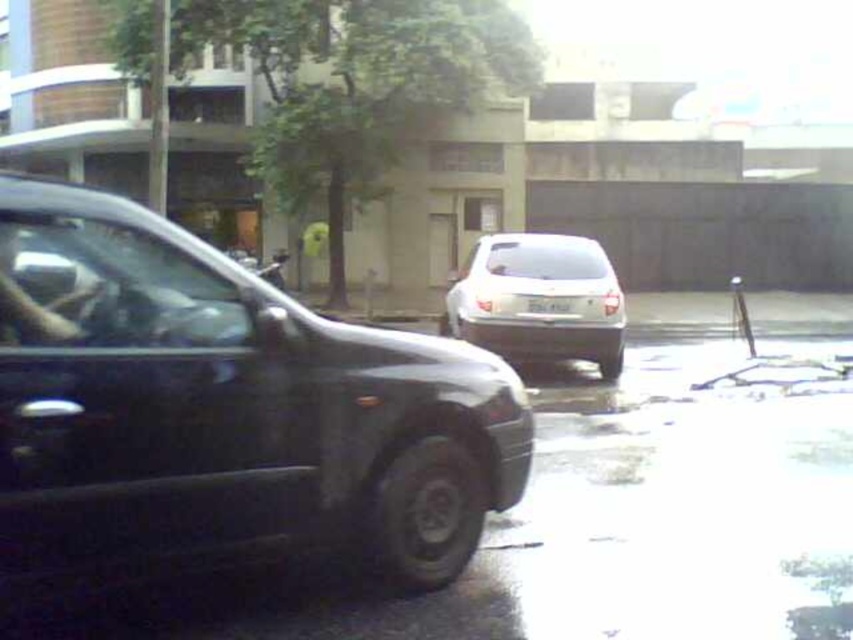
Is satin white suv at center taller than white plastic license plate at center?

Indeed, satin white suv at center has a greater height compared to white plastic license plate at center.

Does satin white suv at center have a larger size compared to white plastic license plate at center?

Correct, satin white suv at center is larger in size than white plastic license plate at center.

Identify the location of satin white suv at center. (538, 296).

Can you confirm if shiny black sedan at left is bigger than satin white suv at center?

Incorrect, shiny black sedan at left is not larger than satin white suv at center.

Between point (415, 378) and point (515, 301), which one is positioned behind?

Point (515, 301)

Locate an element on the screen. The width and height of the screenshot is (853, 640). shiny black sedan at left is located at coordinates [222, 412].

Which is in front, point (91, 204) or point (560, 310)?

Point (91, 204)

Is shiny black sedan at left positioned at the back of white plastic license plate at center?

No, shiny black sedan at left is in front of white plastic license plate at center.

Describe the element at coordinates (222, 412) in the screenshot. Image resolution: width=853 pixels, height=640 pixels. I see `shiny black sedan at left` at that location.

Find the location of a particular element. shiny black sedan at left is located at coordinates (222, 412).